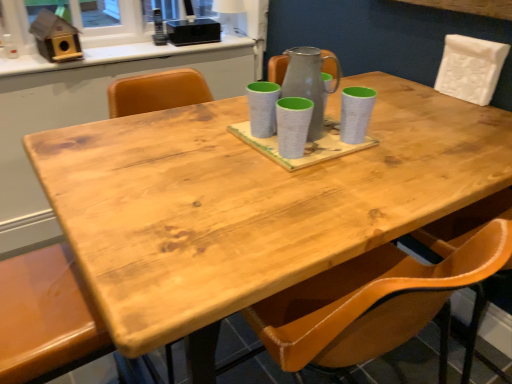
Question: Is matte brown chair at lower left, marked as the 2th chair in a right-to-left arrangement, bigger than speckled ceramic mug at center, acting as the third mug starting from the left?

Choices:
 (A) no
 (B) yes

Answer: (B)

Question: Is matte brown chair at lower left, marked as the 2th chair in a right-to-left arrangement, behind speckled ceramic mug at center, arranged as the 1th mug when viewed from the right?

Choices:
 (A) yes
 (B) no

Answer: (B)

Question: Is matte brown chair at lower left, the 1th chair when ordered from left to right, shorter than speckled ceramic mug at center, acting as the third mug starting from the left?

Choices:
 (A) yes
 (B) no

Answer: (B)

Question: Could speckled ceramic mug at center, acting as the third mug starting from the left, be considered to be inside matte brown chair at lower left, which appears as the first chair when ordered from the bottom?

Choices:
 (A) yes
 (B) no

Answer: (B)

Question: Is matte brown chair at lower left, which appears as the first chair when ordered from the bottom, facing towards speckled ceramic mug at center, acting as the third mug starting from the left?

Choices:
 (A) yes
 (B) no

Answer: (A)

Question: From a real-world perspective, is matte brown chair at lower left, which appears as the first chair when ordered from the bottom, on speckled ceramic mug at center, acting as the third mug starting from the left?

Choices:
 (A) no
 (B) yes

Answer: (A)

Question: Does white glossy counter top at upper center have a lesser height compared to matte gray mug at center, marked as the third mug in a right-to-left arrangement?

Choices:
 (A) yes
 (B) no

Answer: (A)

Question: Is white glossy counter top at upper center oriented towards matte gray mug at center, marked as the third mug in a right-to-left arrangement?

Choices:
 (A) no
 (B) yes

Answer: (A)

Question: From a real-world perspective, does white glossy counter top at upper center sit lower than matte gray mug at center, marked as the third mug in a right-to-left arrangement?

Choices:
 (A) no
 (B) yes

Answer: (B)

Question: Does white glossy counter top at upper center touch matte gray mug at center, the first mug in the left-to-right sequence?

Choices:
 (A) yes
 (B) no

Answer: (B)

Question: Is the position of white glossy counter top at upper center less distant than that of matte gray mug at center, marked as the third mug in a right-to-left arrangement?

Choices:
 (A) no
 (B) yes

Answer: (A)

Question: Is white glossy counter top at upper center behind matte gray mug at center, marked as the third mug in a right-to-left arrangement?

Choices:
 (A) no
 (B) yes

Answer: (B)

Question: Considering the relative sizes of white matte chair at upper right, arranged as the first chair when viewed from the right, and white glossy counter top at upper center in the image provided, is white matte chair at upper right, arranged as the first chair when viewed from the right, wider than white glossy counter top at upper center?

Choices:
 (A) yes
 (B) no

Answer: (B)